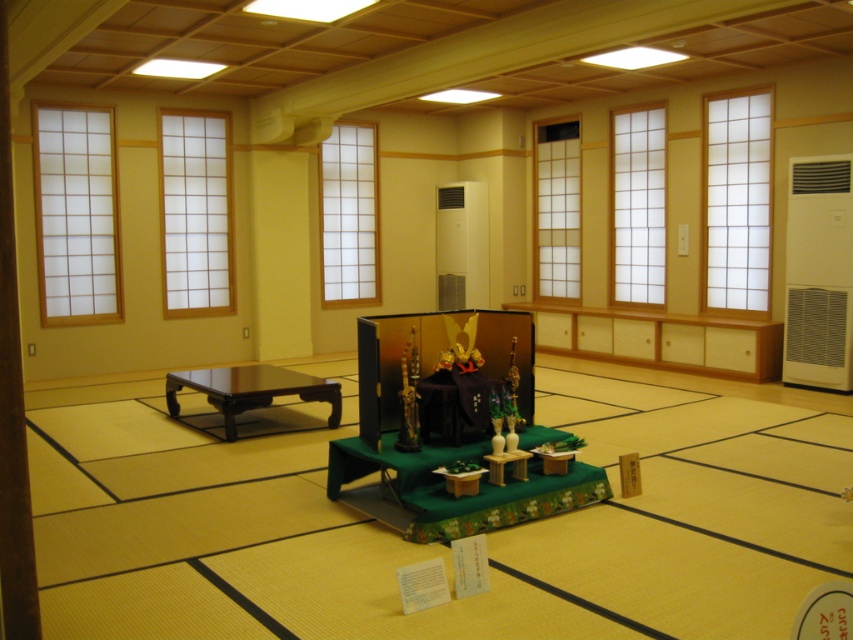
You are standing in the traditional Japanese room and want to move from the entrance to the display setup in the foreground. There are two points marked as point 1 at coordinates point (15, 452) and point 2 at coordinates point (190, 371). Which point should you step on first to reach the display setup more directly?

Point 1 at coordinates point (15, 452) is in front of point 2 at coordinates point (190, 371), so stepping on point 1 first would lead you more directly to the display setup.

Consider the image. You are standing in the traditional Japanese room and want to move towards the display setup in the foreground. There is a brown wooden pillar at left. Which direction should you avoid to prevent bumping into the pillar?

You should avoid moving towards the left side since the brown wooden pillar at left is positioned at point (12,406), which is on the left side of the room.